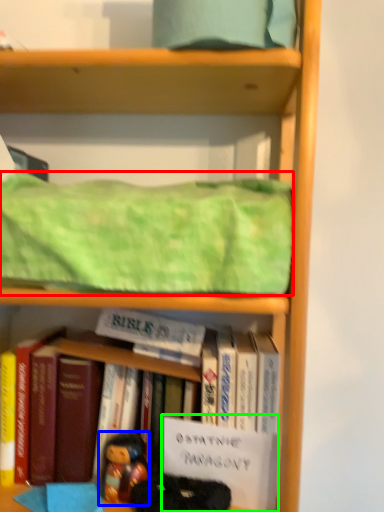
Question: Estimate the real-world distances between objects in this image. Which object is closer to blanket (highlighted by a red box), person (highlighted by a blue box) or paperback book (highlighted by a green box)?

Choices:
 (A) person
 (B) paperback book

Answer: (B)